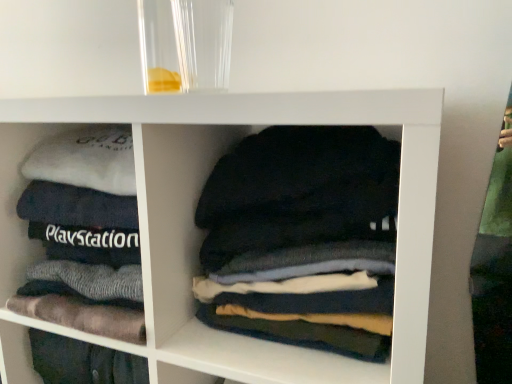
Locate an element on the screen. The width and height of the screenshot is (512, 384). white soft fabric at left is located at coordinates (82, 316).

The image size is (512, 384). Describe the element at coordinates (82, 316) in the screenshot. I see `white soft fabric at left` at that location.

Measure the distance between dark gray cotton shirts at center and camera.

dark gray cotton shirts at center and camera are 22.34 inches apart.

Find the location of a particular element. The image size is (512, 384). dark gray cotton shirts at center is located at coordinates (303, 238).

What do you see at coordinates (303, 238) in the screenshot? This screenshot has width=512, height=384. I see `dark gray cotton shirts at center` at bounding box center [303, 238].

Locate an element on the screen. The image size is (512, 384). white soft fabric at left is located at coordinates (82, 316).

Is white soft fabric at left at the left side of dark gray cotton shirts at center?

Yes.

Is white soft fabric at left closer to the viewer compared to dark gray cotton shirts at center?

No, the depth of white soft fabric at left is greater than that of dark gray cotton shirts at center.

Considering the positions of points (49, 321) and (295, 270), is point (49, 321) farther from camera compared to point (295, 270)?

Yes, it is.

From the image's perspective, which one is positioned higher, white soft fabric at left or dark gray cotton shirts at center?

white soft fabric at left.

From a real-world perspective, is white soft fabric at left positioned over dark gray cotton shirts at center based on gravity?

Yes, from a real-world perspective, white soft fabric at left is on top of dark gray cotton shirts at center.

Considering the relative sizes of white soft fabric at left and dark gray cotton shirts at center in the image provided, is white soft fabric at left wider than dark gray cotton shirts at center?

Yes.

Who is taller, white soft fabric at left or dark gray cotton shirts at center?

white soft fabric at left.

Considering the relative sizes of white soft fabric at left and dark gray cotton shirts at center in the image provided, is white soft fabric at left bigger than dark gray cotton shirts at center?

Correct, white soft fabric at left is larger in size than dark gray cotton shirts at center.

Does white soft fabric at left contain dark gray cotton shirts at center?

No, dark gray cotton shirts at center is located outside of white soft fabric at left.

Is white soft fabric at left positioned far away from dark gray cotton shirts at center?

No, white soft fabric at left is in close proximity to dark gray cotton shirts at center.

Is dark gray cotton shirts at center at the back of white soft fabric at left?

No.

Can you tell me how much white soft fabric at left and dark gray cotton shirts at center differ in facing direction?

The facing directions of white soft fabric at left and dark gray cotton shirts at center are 5.41e-05 degrees apart.

Locate an element on the screen. The image size is (512, 384). laundry on the right side of white soft fabric at left is located at coordinates (303, 238).

Which is more to the right, dark gray cotton shirts at center or white soft fabric at left?

From the viewer's perspective, dark gray cotton shirts at center appears more on the right side.

Which is in front, dark gray cotton shirts at center or white soft fabric at left?

A: dark gray cotton shirts at center is more forward.

Considering the points (231, 309) and (82, 326), which point is in front, point (231, 309) or point (82, 326)?

The point (231, 309) is closer.

From the image's perspective, relative to white soft fabric at left, is dark gray cotton shirts at center above or below?

dark gray cotton shirts at center is below white soft fabric at left.

From a real-world perspective, which is physically above, dark gray cotton shirts at center or white soft fabric at left?

white soft fabric at left is physically above.

Does dark gray cotton shirts at center have a greater width compared to white soft fabric at left?

In fact, dark gray cotton shirts at center might be narrower than white soft fabric at left.

Is dark gray cotton shirts at center shorter than white soft fabric at left?

Indeed, dark gray cotton shirts at center has a lesser height compared to white soft fabric at left.

Which of these two, dark gray cotton shirts at center or white soft fabric at left, is smaller?

dark gray cotton shirts at center.

Is dark gray cotton shirts at center inside the boundaries of white soft fabric at left, or outside?

dark gray cotton shirts at center is not inside white soft fabric at left, it's outside.

Does dark gray cotton shirts at center touch white soft fabric at left?

No, dark gray cotton shirts at center is not touching white soft fabric at left.

Does dark gray cotton shirts at center turn towards white soft fabric at left?

No, dark gray cotton shirts at center is not facing towards white soft fabric at left.

Looking at this image, how different are the orientations of dark gray cotton shirts at center and white soft fabric at left in degrees?

The angle between the facing direction of dark gray cotton shirts at center and the facing direction of white soft fabric at left is 5.41e-05 degrees.

Find the location of a particular element. material above the dark gray cotton shirts at center (from the image's perspective) is located at coordinates (82, 316).

At what (x,y) coordinates should I click in order to perform the action: click on material above the dark gray cotton shirts at center (from a real-world perspective). Please return your answer as a coordinate pair (x, y). Looking at the image, I should click on (82, 316).

You are a GUI agent. You are given a task and a screenshot of the screen. Output one action in this format:
    pyautogui.click(x=<x>, y=<y>)
    Task: Click on the material behind the dark gray cotton shirts at center
    This screenshot has width=512, height=384.
    Given the screenshot: What is the action you would take?
    pyautogui.click(x=82, y=316)